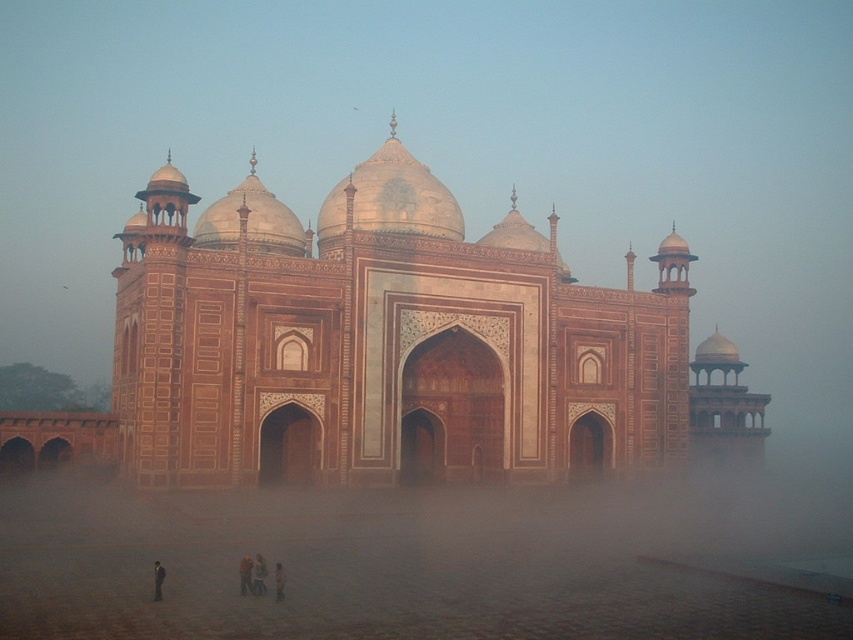
Between marble palace at center and light brown fabric pants at lower center, which one has less height?

light brown fabric pants at lower center

Does marble palace at center have a smaller size compared to light brown fabric pants at lower center?

Incorrect, marble palace at center is not smaller in size than light brown fabric pants at lower center.

Locate an element on the screen. The width and height of the screenshot is (853, 640). marble palace at center is located at coordinates (381, 340).

The height and width of the screenshot is (640, 853). I want to click on marble palace at center, so click(381, 340).

Does light brown leather jacket at lower center have a smaller size compared to dark blue fabric at lower center?

Actually, light brown leather jacket at lower center might be larger than dark blue fabric at lower center.

Is light brown leather jacket at lower center wider than dark blue fabric at lower center?

Yes, light brown leather jacket at lower center is wider than dark blue fabric at lower center.

Is point (247, 561) more distant than point (160, 584)?

Yes.

This screenshot has width=853, height=640. I want to click on light brown leather jacket at lower center, so click(245, 573).

Between marble palace at center and dark blue fabric at lower center, which one is positioned higher?

marble palace at center

Is point (326, 289) positioned in front of point (158, 579)?

No, (326, 289) is further to viewer.

Identify the location of marble palace at center. pyautogui.click(x=381, y=340).